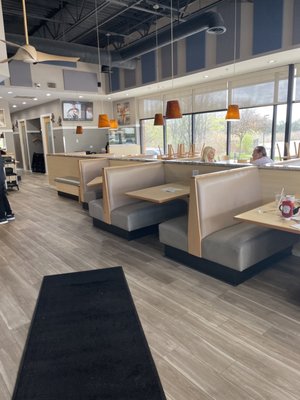
Find the location of `rug`. rug is located at coordinates (106, 343).